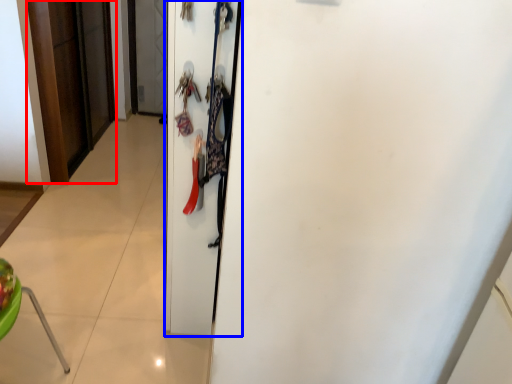
Question: Which of the following is the farthest to the observer, door (highlighted by a red box) or door (highlighted by a blue box)?

Choices:
 (A) door
 (B) door

Answer: (A)